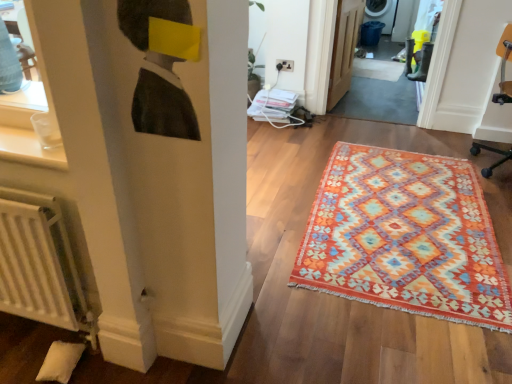
The image size is (512, 384). Find the location of `empty space that is ontop of multicolored woven rug at center (from a real-world perspective)`. empty space that is ontop of multicolored woven rug at center (from a real-world perspective) is located at coordinates (398, 215).